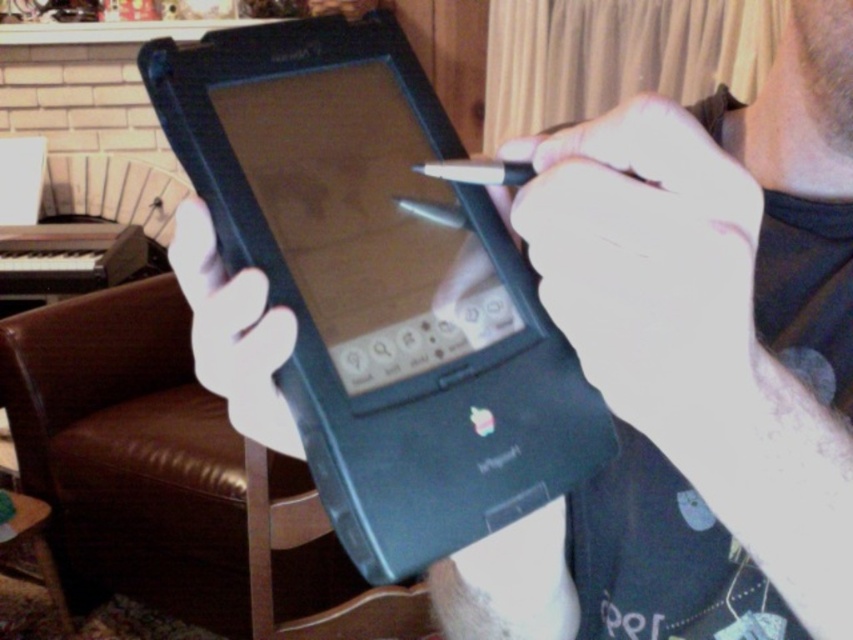
Who is lower down, black plastic tablet at center or white matte pen at upper center?

white matte pen at upper center is lower down.

Does point (364, 465) lie in front of point (653, 202)?

No.

Who is more distant from viewer, (161, 74) or (758, 225)?

The point (161, 74) is behind.

Image resolution: width=853 pixels, height=640 pixels. Identify the location of black plastic tablet at center. (380, 285).

Is black plastic tablet at center closer to camera compared to white matte hand at center?

Yes, it is.

Locate an element on the screen. Image resolution: width=853 pixels, height=640 pixels. black plastic tablet at center is located at coordinates (380, 285).

How distant is white matte pen at upper center from white matte hand at center?

white matte pen at upper center and white matte hand at center are 4.85 inches apart.

Is point (737, 260) farther from viewer compared to point (229, 412)?

No.

The height and width of the screenshot is (640, 853). What do you see at coordinates (648, 262) in the screenshot? I see `white matte pen at upper center` at bounding box center [648, 262].

Where is `white matte pen at upper center`? white matte pen at upper center is located at coordinates (648, 262).